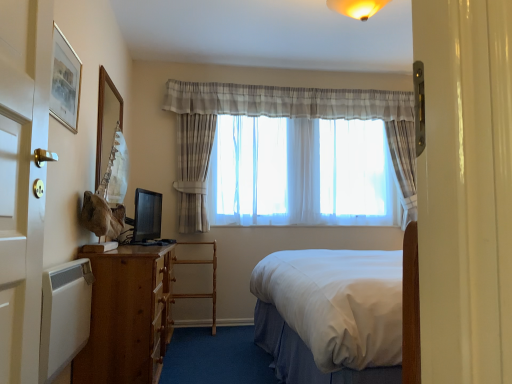
Question: From a real-world perspective, is wooden picture frame at upper left, placed as the second picture frame when sorted from front to back, below translucent fabric curtain at center?

Choices:
 (A) yes
 (B) no

Answer: (A)

Question: From the image's perspective, would you say wooden picture frame at upper left, arranged as the 2th picture frame when viewed from the right, is positioned over translucent fabric curtain at center?

Choices:
 (A) yes
 (B) no

Answer: (A)

Question: Does wooden picture frame at upper left, arranged as the 2th picture frame when viewed from the right, have a smaller size compared to translucent fabric curtain at center?

Choices:
 (A) yes
 (B) no

Answer: (A)

Question: Does wooden picture frame at upper left, acting as the first picture frame starting from the back, touch translucent fabric curtain at center?

Choices:
 (A) no
 (B) yes

Answer: (A)

Question: Considering the relative positions of wooden picture frame at upper left, arranged as the 1th picture frame when viewed from the left, and translucent fabric curtain at center in the image provided, is wooden picture frame at upper left, arranged as the 1th picture frame when viewed from the left, to the left of translucent fabric curtain at center from the viewer's perspective?

Choices:
 (A) no
 (B) yes

Answer: (B)

Question: From a real-world perspective, is matte black monitor at left above or below white matte radiator at lower left?

Choices:
 (A) below
 (B) above

Answer: (B)

Question: Based on their sizes in the image, would you say matte black monitor at left is bigger or smaller than white matte radiator at lower left?

Choices:
 (A) small
 (B) big

Answer: (A)

Question: In the image, is matte black monitor at left positioned in front of or behind white matte radiator at lower left?

Choices:
 (A) behind
 (B) front

Answer: (A)

Question: In the image, is matte black monitor at left on the left side or the right side of white matte radiator at lower left?

Choices:
 (A) left
 (B) right

Answer: (A)

Question: Is translucent fabric curtain at center inside or outside of white matte radiator at lower left?

Choices:
 (A) inside
 (B) outside

Answer: (B)

Question: Visually, is translucent fabric curtain at center positioned to the left or to the right of white matte radiator at lower left?

Choices:
 (A) left
 (B) right

Answer: (B)

Question: In terms of width, does translucent fabric curtain at center look wider or thinner when compared to white matte radiator at lower left?

Choices:
 (A) wide
 (B) thin

Answer: (A)

Question: Is point (317, 183) closer or farther from the camera than point (44, 382)?

Choices:
 (A) farther
 (B) closer

Answer: (A)

Question: In the image, is wooden ladder at center on the left side or the right side of gold-framed picture at upper left, placed as the second picture frame when sorted from left to right?

Choices:
 (A) left
 (B) right

Answer: (B)

Question: Which is correct: wooden ladder at center is inside gold-framed picture at upper left, arranged as the second picture frame when viewed from the back, or outside of it?

Choices:
 (A) outside
 (B) inside

Answer: (A)